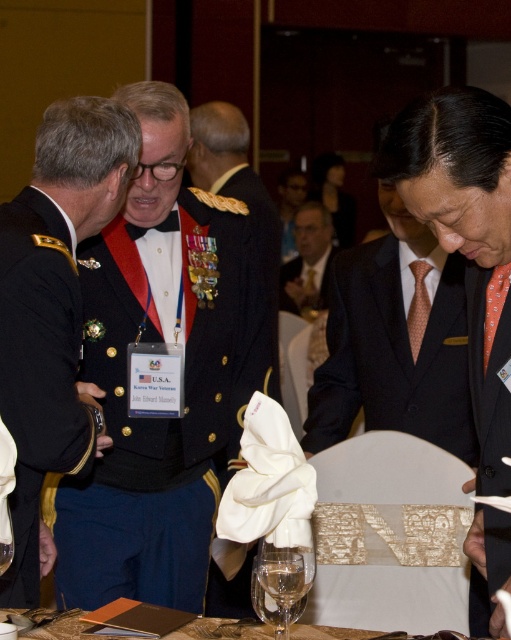
Question: Among these points, which one is farthest from the camera?

Choices:
 (A) (473, 216)
 (B) (11, 545)
 (C) (190, 593)

Answer: (C)

Question: Is shiny black fabric at left further to camera compared to polished dark suit at center?

Choices:
 (A) no
 (B) yes

Answer: (A)

Question: Does orange dotted tie at right have a lesser width compared to clear glass wine glass at lower center?

Choices:
 (A) yes
 (B) no

Answer: (B)

Question: Is shiny black fabric at left below polished dark suit at center?

Choices:
 (A) no
 (B) yes

Answer: (B)

Question: Based on their relative distances, which object is farther from the shiny black fabric at center?

Choices:
 (A) translucent glass wine at center
 (B) shiny black fabric at left
 (C) polished dark suit at center
 (D) gold textured epaulets at upper center

Answer: (D)

Question: Which is farther from the gold textured epaulets at upper center?

Choices:
 (A) smooth gold tie at center
 (B) translucent glass wine at center
 (C) shiny black fabric at left
 (D) polished dark suit at center

Answer: (B)